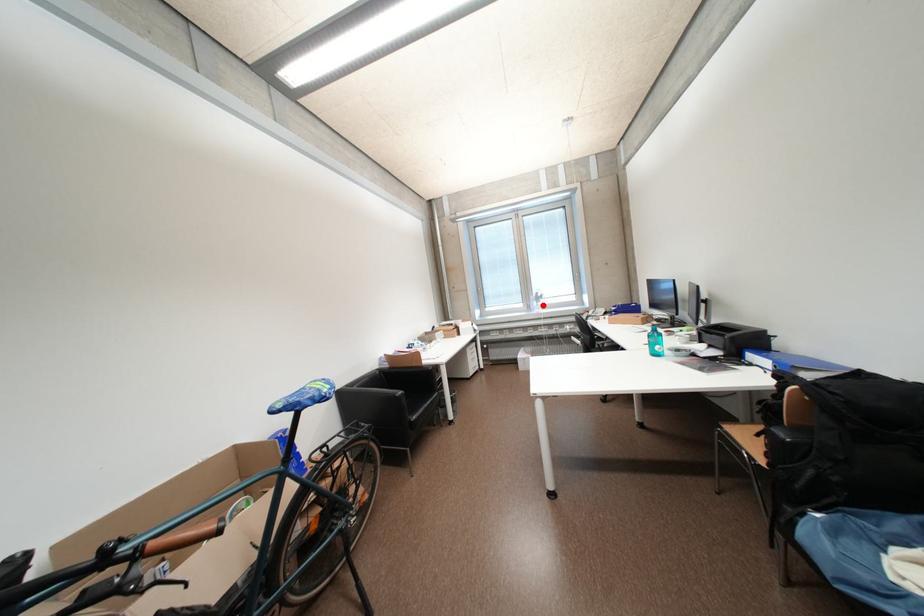
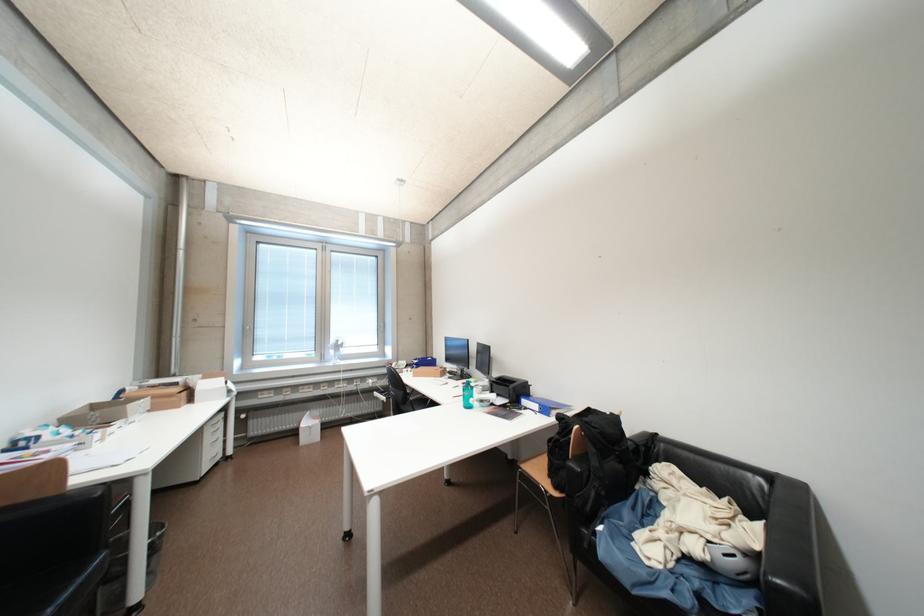
The point at the highlighted location is marked in the first image. Where is the corresponding point in the second image?

(339, 354)